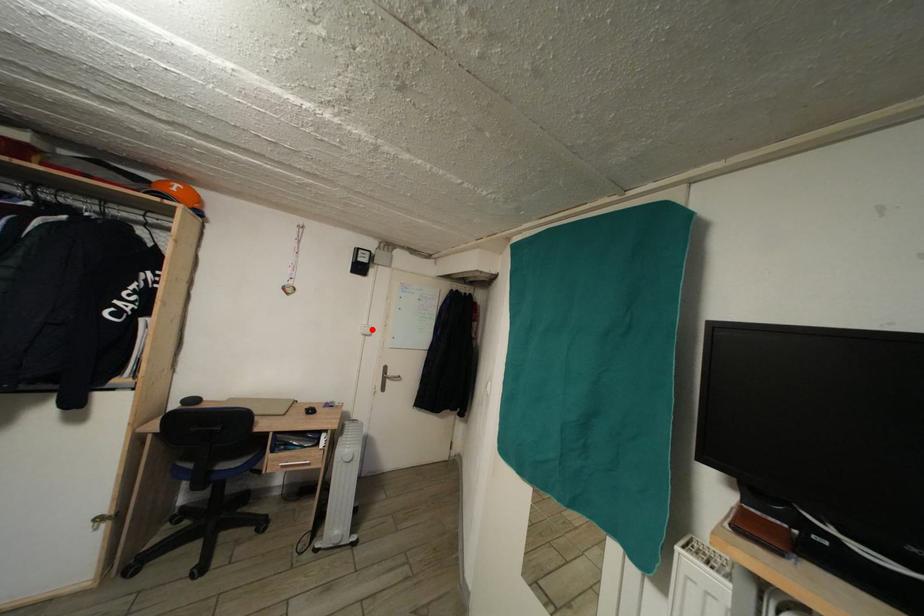
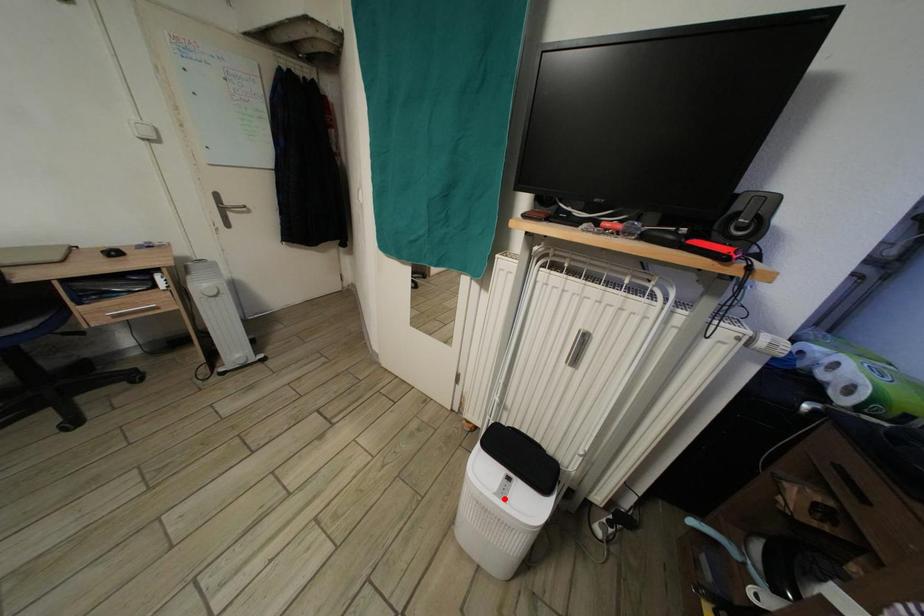
I am providing you with two images of the same scene from different viewpoints. A red point is marked on the first image and another point is marked on the second image. Do the highlighted points in image1 and image2 indicate the same real-world spot?

No